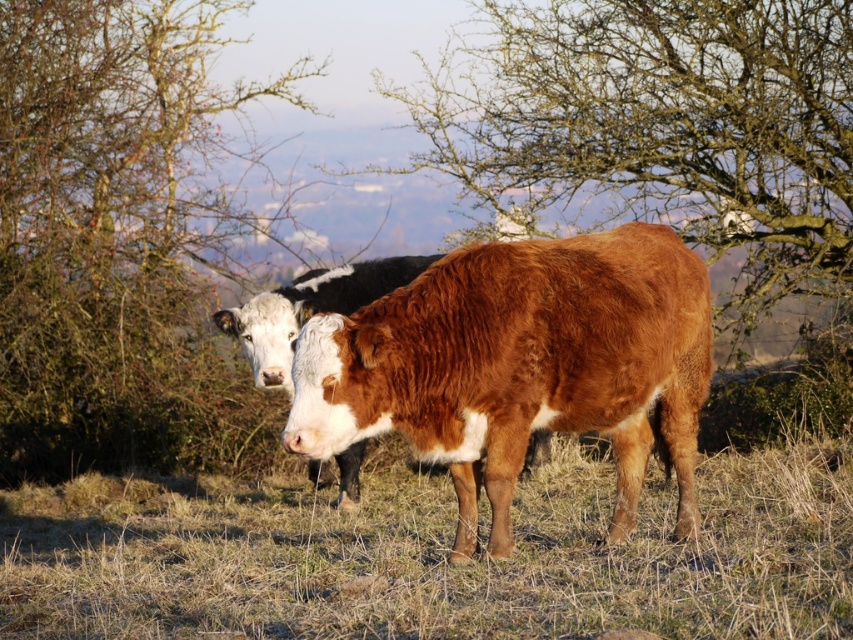
Question: Is brown dry grass at center above green leafy tree at left?

Choices:
 (A) no
 (B) yes

Answer: (A)

Question: Can you confirm if brown dry grass at center is positioned to the left of bare branches at center?

Choices:
 (A) yes
 (B) no

Answer: (A)

Question: Among these points, which one is nearest to the camera?

Choices:
 (A) (323, 442)
 (B) (160, 58)
 (C) (759, 33)
 (D) (662, 492)

Answer: (A)

Question: Which object is positioned closest to the brown textured cow at center?

Choices:
 (A) brown dry grass at center
 (B) green leafy tree at left
 (C) brown furry cow at center

Answer: (C)

Question: Which point appears closest to the camera in this image?

Choices:
 (A) (364, 305)
 (B) (41, 502)

Answer: (A)

Question: Is the position of brown dry grass at center less distant than that of brown textured cow at center?

Choices:
 (A) no
 (B) yes

Answer: (A)